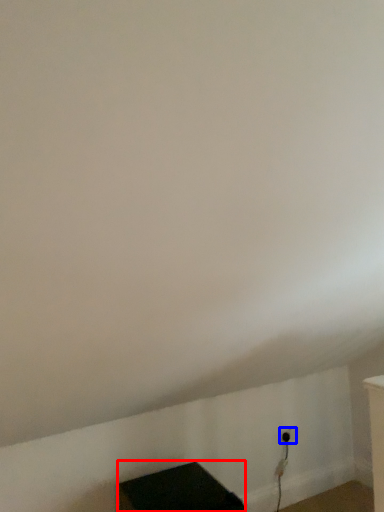
Question: Which of the following is the farthest to the observer, furniture (highlighted by a red box) or electric outlet (highlighted by a blue box)?

Choices:
 (A) furniture
 (B) electric outlet

Answer: (B)